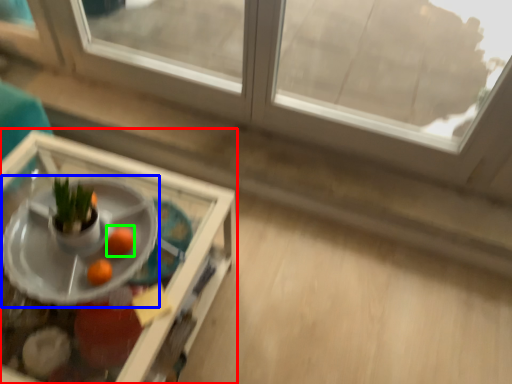
Question: Which object is the farthest from table (highlighted by a red box)? Choose among these: table (highlighted by a blue box) or orange (highlighted by a green box).

Choices:
 (A) table
 (B) orange

Answer: (B)